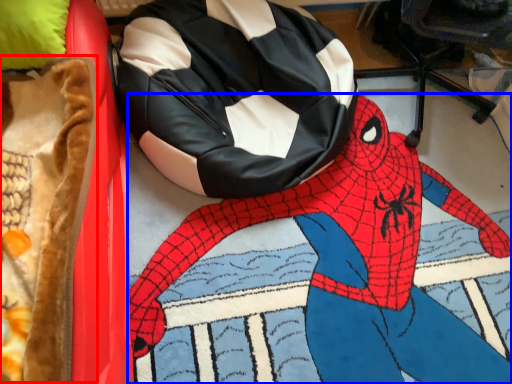
Question: Which object appears closest to the camera in this image, blanket (highlighted by a red box) or person (highlighted by a blue box)?

Choices:
 (A) blanket
 (B) person

Answer: (A)